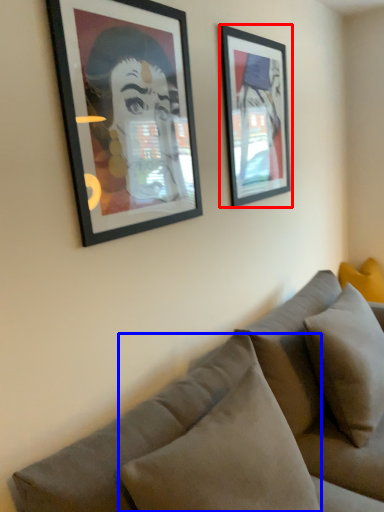
Question: Which object is further to the camera taking this photo, picture frame (highlighted by a red box) or pillow (highlighted by a blue box)?

Choices:
 (A) picture frame
 (B) pillow

Answer: (A)